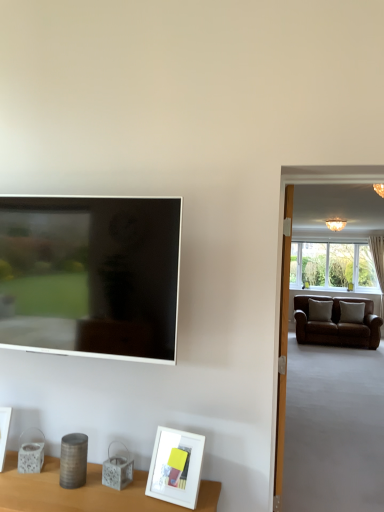
You are a GUI agent. You are given a task and a screenshot of the screen. Output one action in this format:
    pyautogui.click(x=<x>, y=<y>)
    Task: Click on the blank space above matte black tv at left (from a real-world perspective)
    
    Given the screenshot: What is the action you would take?
    pyautogui.click(x=77, y=199)